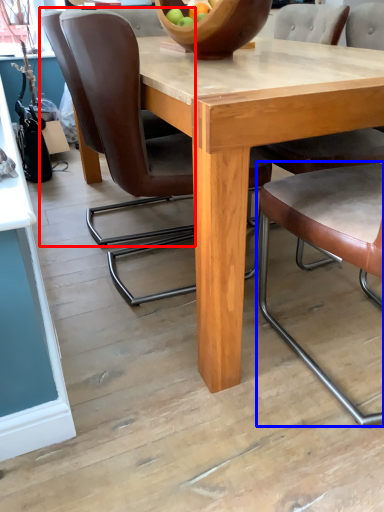
Question: Which object appears farthest to the camera in this image, chair (highlighted by a red box) or chair (highlighted by a blue box)?

Choices:
 (A) chair
 (B) chair

Answer: (A)